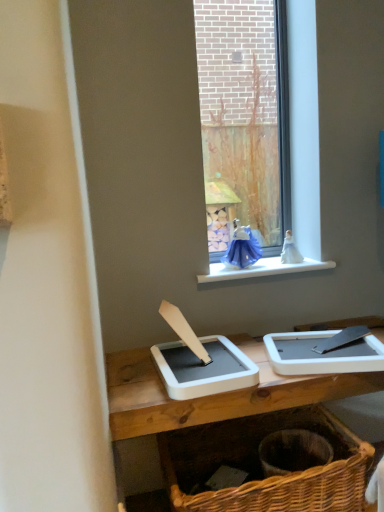
The image size is (384, 512). What do you see at coordinates (260, 465) in the screenshot?
I see `woven brown basket at lower right` at bounding box center [260, 465].

At what (x,y) coordinates should I click in order to perform the action: click on white plastic window sill at upper center. Please return your answer as a coordinate pair (x, y). Looking at the image, I should click on (262, 269).

The height and width of the screenshot is (512, 384). What do you see at coordinates (305, 118) in the screenshot?
I see `blue glass window at center` at bounding box center [305, 118].

Identify the location of woven brown basket at lower right. The height and width of the screenshot is (512, 384). (260, 465).

Is woven brown basket at lower right positioned with its back to white plastic window sill at upper center?

No, woven brown basket at lower right is not facing away from white plastic window sill at upper center.

In terms of width, does woven brown basket at lower right look wider or thinner when compared to white plastic window sill at upper center?

In the image, woven brown basket at lower right appears to be wider than white plastic window sill at upper center.

Can you confirm if woven brown basket at lower right is taller than white plastic window sill at upper center?

Yes.

Choose the correct answer: Is woven brown basket at lower right inside white plastic window sill at upper center or outside it?

woven brown basket at lower right cannot be found inside white plastic window sill at upper center.

Is blue glass window at center in contact with white plastic window sill at upper center?

No, blue glass window at center is not in contact with white plastic window sill at upper center.

Is point (317, 181) behind point (329, 263)?

No.

Considering the positions of objects blue glass window at center and white plastic window sill at upper center in the image provided, who is more to the left, blue glass window at center or white plastic window sill at upper center?

blue glass window at center.

In the scene shown: Is blue glass window at center aimed at white plastic window sill at upper center?

Yes.

Can you tell me how much blue glass window at center and woven brown basket at lower right differ in facing direction?

The angular difference between blue glass window at center and woven brown basket at lower right is 2.35 degrees.

Which object is positioned more to the left, blue glass window at center or woven brown basket at lower right?

woven brown basket at lower right.

From the image's perspective, is blue glass window at center on top of woven brown basket at lower right?

Indeed, from the image's perspective, blue glass window at center is shown above woven brown basket at lower right.

Considering the sizes of objects blue glass window at center and woven brown basket at lower right in the image provided, who is smaller, blue glass window at center or woven brown basket at lower right?

With smaller size is blue glass window at center.

From the image's perspective, between woven brown basket at lower right and blue glass window at center, who is located below?

From the image's view, woven brown basket at lower right is below.

Is blue glass window at center at the back of woven brown basket at lower right?

woven brown basket at lower right is not turned away from blue glass window at center.

From a real-world perspective, which is physically above, woven brown basket at lower right or blue glass window at center?

From a 3D spatial view, blue glass window at center is above.

Is point (327, 411) less distant than point (302, 220)?

No, it is behind (302, 220).

From the picture: Is white plastic window sill at upper center spatially inside woven brown basket at lower right, or outside of it?

white plastic window sill at upper center is spatially situated outside woven brown basket at lower right.

Consider the image. Are white plastic window sill at upper center and woven brown basket at lower right far apart?

No, white plastic window sill at upper center is not far away from woven brown basket at lower right.

Is white plastic window sill at upper center looking in the opposite direction of woven brown basket at lower right?

white plastic window sill at upper center is not turned away from woven brown basket at lower right.

Does white plastic window sill at upper center come behind woven brown basket at lower right?

Yes.

Is blue glass window at center at the back of white plastic window sill at upper center?

That's right, white plastic window sill at upper center is facing away from blue glass window at center.

Does white plastic window sill at upper center have a greater height compared to blue glass window at center?

No, white plastic window sill at upper center is not taller than blue glass window at center.

Which is more to the right, white plastic window sill at upper center or blue glass window at center?

white plastic window sill at upper center.

Find the location of a particular element. The height and width of the screenshot is (512, 384). window sill behind the woven brown basket at lower right is located at coordinates (262, 269).

At what (x,y) coordinates should I click in order to perform the action: click on window lying on the left of white plastic window sill at upper center. Please return your answer as a coordinate pair (x, y). This screenshot has width=384, height=512. Looking at the image, I should click on (305, 118).

Estimate the real-world distances between objects in this image. Which object is further from white plastic window sill at upper center, blue glass window at center or woven brown basket at lower right?

Based on the image, woven brown basket at lower right appears to be further to white plastic window sill at upper center.

Which object lies nearer to the anchor point woven brown basket at lower right, blue glass window at center or white plastic window sill at upper center?

white plastic window sill at upper center lies closer to woven brown basket at lower right than the other object.

From the image, which object appears to be farther from woven brown basket at lower right, white plastic window sill at upper center or blue glass window at center?

blue glass window at center is further to woven brown basket at lower right.

Which object lies further to the anchor point blue glass window at center, woven brown basket at lower right or white plastic window sill at upper center?

woven brown basket at lower right is positioned further to the anchor blue glass window at center.

Based on their spatial positions, is woven brown basket at lower right or blue glass window at center further from white plastic window sill at upper center?

Based on the image, woven brown basket at lower right appears to be further to white plastic window sill at upper center.

From the image, which object appears to be farther from blue glass window at center, white plastic window sill at upper center or woven brown basket at lower right?

woven brown basket at lower right is further to blue glass window at center.

The height and width of the screenshot is (512, 384). What are the coordinates of `window sill between blue glass window at center and woven brown basket at lower right from top to bottom` in the screenshot? It's located at (262, 269).